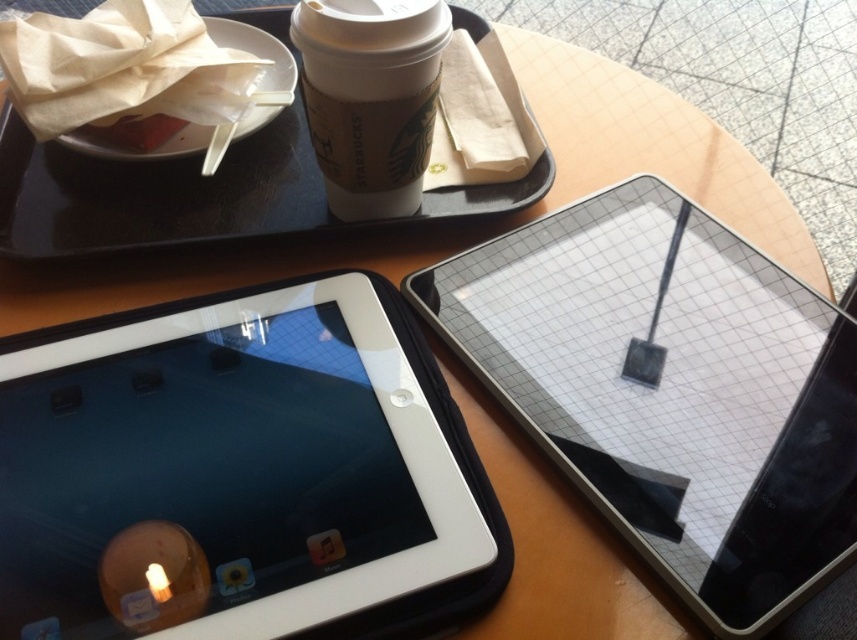
Question: Which point is farther to the camera?

Choices:
 (A) (315, 296)
 (B) (572, 300)
 (C) (111, 241)
 (D) (412, 104)

Answer: (C)

Question: Can you confirm if black glossy tablet at center is thinner than white paper cup at upper center?

Choices:
 (A) no
 (B) yes

Answer: (A)

Question: Is the position of white glossy tablet at center more distant than that of white paper cup at upper center?

Choices:
 (A) no
 (B) yes

Answer: (A)

Question: Considering the real-world distances, which object is farthest from the black glossy tablet at center?

Choices:
 (A) black plastic tray at upper center
 (B) white paper cup at upper center

Answer: (B)

Question: In this image, where is white glossy tablet at center located relative to black glossy tablet at center?

Choices:
 (A) above
 (B) below

Answer: (B)

Question: Which point is closer to the camera?

Choices:
 (A) (405, 138)
 (B) (162, 211)
 (C) (196, 353)
 (D) (837, 556)

Answer: (D)